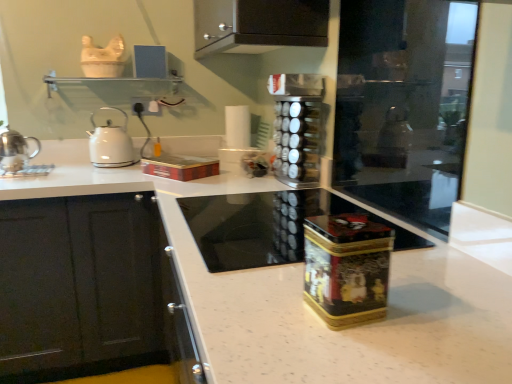
You are a GUI agent. You are given a task and a screenshot of the screen. Output one action in this format:
    pyautogui.click(x=<x>, y=<y>)
    Task: Click on the metallic gold and black tin at center, which appears as the 2th appliance when viewed from the top
    The width and height of the screenshot is (512, 384).
    Given the screenshot: What is the action you would take?
    [x=347, y=268]

This screenshot has width=512, height=384. Describe the element at coordinates (180, 167) in the screenshot. I see `metallic red box at center` at that location.

Where is `shiny silver teapot at left, which is the 2th kitchen appliance from right to left`? The width and height of the screenshot is (512, 384). shiny silver teapot at left, which is the 2th kitchen appliance from right to left is located at coordinates (15, 151).

Based on the photo, from the image's perspective, which one is positioned lower, black glass cooktop at center or black metallic spice rack at center, which appears as the 2th appliance when viewed from the front?

From the image's view, black glass cooktop at center is below.

Is black glass cooktop at center not close to black metallic spice rack at center, placed as the first appliance when sorted from top to bottom?

No, black glass cooktop at center is not far from black metallic spice rack at center, placed as the first appliance when sorted from top to bottom.

In the scene shown: Is black metallic spice rack at center, which appears as the 2th appliance when viewed from the front, inside black glass cooktop at center?

No, black metallic spice rack at center, which appears as the 2th appliance when viewed from the front, is not a part of black glass cooktop at center.

The image size is (512, 384). I want to click on home appliance beneath the black metallic spice rack at center, marked as the 1th appliance in a back-to-front arrangement (from a real-world perspective), so click(267, 226).

Between transparent glass screen door at right and shiny silver teapot at left, which is counted as the 1th kitchen appliance, starting from the front, which one appears on the left side from the viewer's perspective?

shiny silver teapot at left, which is counted as the 1th kitchen appliance, starting from the front.

From the picture: Is transparent glass screen door at right outside of shiny silver teapot at left, which is the 2th kitchen appliance from right to left?

transparent glass screen door at right lies outside shiny silver teapot at left, which is the 2th kitchen appliance from right to left,'s area.

From the image's perspective, is transparent glass screen door at right below shiny silver teapot at left, which is counted as the 1th kitchen appliance, starting from the front?

Actually, transparent glass screen door at right appears above shiny silver teapot at left, which is counted as the 1th kitchen appliance, starting from the front, in the image.

Is transparent glass screen door at right touching shiny silver teapot at left, which is the first kitchen appliance from left to right?

No, transparent glass screen door at right is not with shiny silver teapot at left, which is the first kitchen appliance from left to right.

From a real-world perspective, who is located higher, transparent glass screen door at right or white speckled granite at center?

transparent glass screen door at right, from a real-world perspective.

Is point (402, 50) behind point (430, 338)?

Yes, it is behind point (430, 338).

Can you confirm if transparent glass screen door at right is wider than white speckled granite at center?

Incorrect, the width of transparent glass screen door at right does not surpass that of white speckled granite at center.

Looking at this image, from the image's perspective, is black glass cooktop at center below white glossy kettle at left, the 2th kitchen appliance viewed from the left?

Indeed, from the image's perspective, black glass cooktop at center is shown beneath white glossy kettle at left, the 2th kitchen appliance viewed from the left.

Would you say black glass cooktop at center is to the left or to the right of white glossy kettle at left, marked as the 1th kitchen appliance in a back-to-front arrangement, in the picture?

black glass cooktop at center is to the right of white glossy kettle at left, marked as the 1th kitchen appliance in a back-to-front arrangement.

Is black glass cooktop at center far from white glossy kettle at left, which is counted as the 2th kitchen appliance, starting from the front?

No.

From a real-world perspective, does black glass cooktop at center sit lower than white glossy kettle at left, marked as the 1th kitchen appliance in a back-to-front arrangement?

Correct, in the physical world, black glass cooktop at center is lower than white glossy kettle at left, marked as the 1th kitchen appliance in a back-to-front arrangement.

From the image's perspective, would you say white glossy kettle at left, which is counted as the 2th kitchen appliance, starting from the front, is shown under black glass cooktop at center?

Actually, white glossy kettle at left, which is counted as the 2th kitchen appliance, starting from the front, appears above black glass cooktop at center in the image.

In terms of size, does white glossy kettle at left, marked as the 1th kitchen appliance in a back-to-front arrangement, appear bigger or smaller than black glass cooktop at center?

Considering their sizes, white glossy kettle at left, marked as the 1th kitchen appliance in a back-to-front arrangement, takes up less space than black glass cooktop at center.

Is black glass cooktop at center completely or partially inside white glossy kettle at left, the 2th kitchen appliance viewed from the left?

That's incorrect, black glass cooktop at center is not inside white glossy kettle at left, the 2th kitchen appliance viewed from the left.

Consider the image. Is white speckled granite at center located outside shiny silver teapot at left, which is the 2th kitchen appliance from right to left?

white speckled granite at center is positioned outside shiny silver teapot at left, which is the 2th kitchen appliance from right to left.

Between point (404, 358) and point (5, 131), which one is positioned in front?

The point (404, 358) is closer to the camera.

Could you tell me if white speckled granite at center is facing shiny silver teapot at left, which is the 2th kitchen appliance from right to left?

No, white speckled granite at center is not aimed at shiny silver teapot at left, which is the 2th kitchen appliance from right to left.

Which of these two, white speckled granite at center or shiny silver teapot at left, acting as the second kitchen appliance starting from the back, is wider?

white speckled granite at center.

Considering the sizes of white glossy kettle at left, which is counted as the 2th kitchen appliance, starting from the front, and white speckled granite at center in the image, is white glossy kettle at left, which is counted as the 2th kitchen appliance, starting from the front, taller or shorter than white speckled granite at center?

Clearly, white glossy kettle at left, which is counted as the 2th kitchen appliance, starting from the front, is shorter compared to white speckled granite at center.

From the image's perspective, which is above, white glossy kettle at left, the 2th kitchen appliance viewed from the left, or white speckled granite at center?

white glossy kettle at left, the 2th kitchen appliance viewed from the left, from the image's perspective.

Which is more to the right, white glossy kettle at left, marked as the 1th kitchen appliance in a back-to-front arrangement, or white speckled granite at center?

white speckled granite at center is more to the right.

From a real-world perspective, is white glossy kettle at left, the first kitchen appliance in the right-to-left sequence, physically located above or below white speckled granite at center?

white glossy kettle at left, the first kitchen appliance in the right-to-left sequence, is situated higher than white speckled granite at center in the real world.

Identify the location of appliance located behind the black glass cooktop at center. (297, 141).

You are a GUI agent. You are given a task and a screenshot of the screen. Output one action in this format:
    pyautogui.click(x=<x>, y=<y>)
    Task: Click on the screen door above the shiny silver teapot at left, which is the 2th kitchen appliance from right to left (from the image's perspective)
    The width and height of the screenshot is (512, 384).
    Given the screenshot: What is the action you would take?
    pyautogui.click(x=404, y=105)

From the image, which object appears to be nearer to metallic gold and black tin at center, placed as the first appliance when sorted from front to back, white glossy kettle at left, marked as the 1th kitchen appliance in a back-to-front arrangement, or shiny silver teapot at left, which is the first kitchen appliance from left to right?

shiny silver teapot at left, which is the first kitchen appliance from left to right, is closer to metallic gold and black tin at center, placed as the first appliance when sorted from front to back.

Estimate the real-world distances between objects in this image. Which object is closer to transparent glass screen door at right, metallic gold and black tin at center, which appears as the 2th appliance when viewed from the top, or white glossy kettle at left, the first kitchen appliance in the right-to-left sequence?

metallic gold and black tin at center, which appears as the 2th appliance when viewed from the top, is positioned closer to the anchor transparent glass screen door at right.

Considering their positions, is white glossy kettle at left, the first kitchen appliance in the right-to-left sequence, positioned further to metallic red box at center than black glass cooktop at center?

Among the two, black glass cooktop at center is located further to metallic red box at center.

From the image, which object appears to be farther from white speckled granite at center, transparent glass screen door at right or metallic gold and black tin at center, placed as the first appliance when sorted from front to back?

transparent glass screen door at right lies further to white speckled granite at center than the other object.

Considering their positions, is white speckled granite at center positioned closer to metallic gold and black tin at center, which appears as the 2th appliance when viewed from the top, than black metallic spice rack at center, placed as the first appliance when sorted from top to bottom?

white speckled granite at center is positioned closer to the anchor metallic gold and black tin at center, which appears as the 2th appliance when viewed from the top.

Which object lies nearer to the anchor point metallic gold and black tin at center, the 2th appliance in the back-to-front sequence, transparent glass screen door at right or black metallic spice rack at center, positioned as the second appliance in bottom-to-top order?

black metallic spice rack at center, positioned as the second appliance in bottom-to-top order, lies closer to metallic gold and black tin at center, the 2th appliance in the back-to-front sequence, than the other object.

Based on the photo, which object lies further to the anchor point black metallic spice rack at center, which appears as the 2th appliance when viewed from the front, metallic red box at center or metallic gold and black tin at center, the 2th appliance in the back-to-front sequence?

metallic gold and black tin at center, the 2th appliance in the back-to-front sequence, lies further to black metallic spice rack at center, which appears as the 2th appliance when viewed from the front, than the other object.

When comparing their distances from transparent glass screen door at right, does white glossy kettle at left, which is counted as the 2th kitchen appliance, starting from the front, or white speckled granite at center seem closer?

Based on the image, white speckled granite at center appears to be nearer to transparent glass screen door at right.

Identify the location of home appliance between metallic gold and black tin at center, the 2th appliance in the back-to-front sequence, and white glossy kettle at left, the first kitchen appliance in the right-to-left sequence, along the z-axis. This screenshot has height=384, width=512. (267, 226).

Identify the location of home appliance positioned between transparent glass screen door at right and metallic red box at center from near to far. This screenshot has width=512, height=384. (267, 226).

Image resolution: width=512 pixels, height=384 pixels. Find the location of `home appliance between white speckled granite at center and black metallic spice rack at center, which appears as the 2th appliance when viewed from the front, in the front-back direction`. home appliance between white speckled granite at center and black metallic spice rack at center, which appears as the 2th appliance when viewed from the front, in the front-back direction is located at coordinates (x=267, y=226).

This screenshot has width=512, height=384. Identify the location of countertop situated between shiny silver teapot at left, which is counted as the 1th kitchen appliance, starting from the front, and transparent glass screen door at right from left to right. [308, 307].